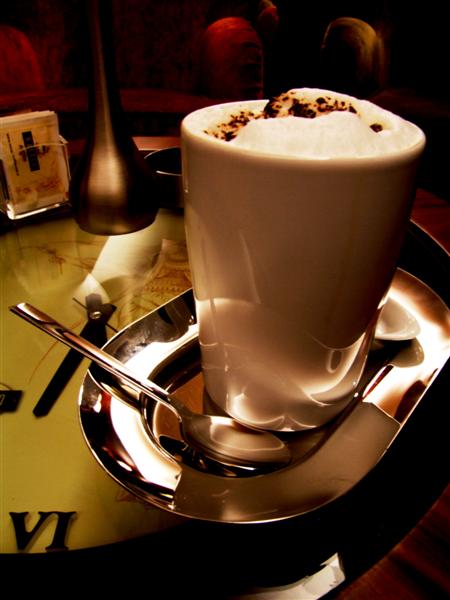
Locate an element on the screen. spoon is located at coordinates (233, 450).